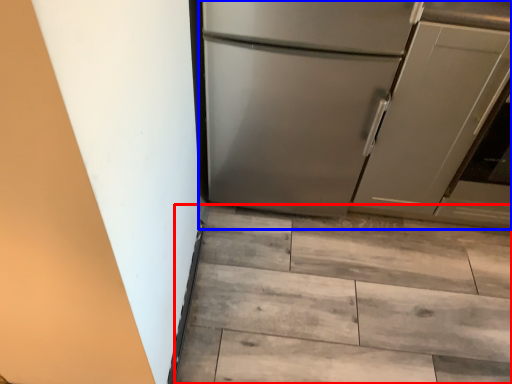
Question: Which of the following is the farthest to the observer, stairwell (highlighted by a red box) or refrigerator (highlighted by a blue box)?

Choices:
 (A) stairwell
 (B) refrigerator

Answer: (A)